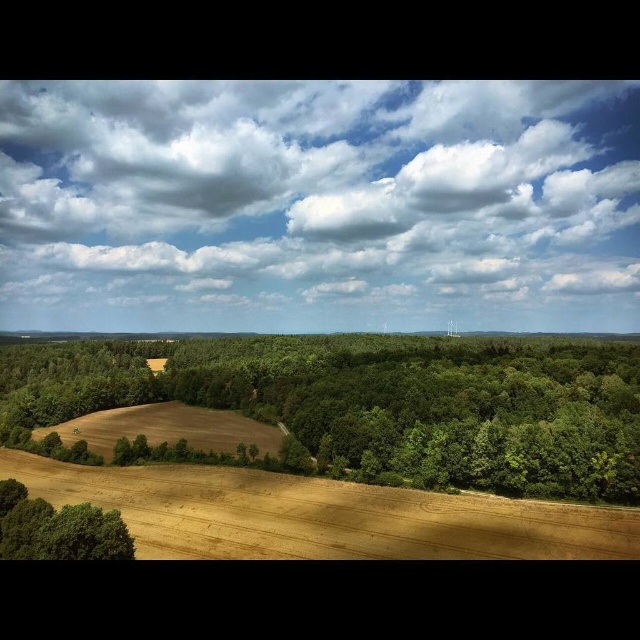
Question: Considering the relative positions of green leafy trees at center and golden dry wheat field at lower center in the image provided, where is green leafy trees at center located with respect to golden dry wheat field at lower center?

Choices:
 (A) left
 (B) right

Answer: (A)

Question: Is green leafy trees at center to the left of green leafy tree at lower left from the viewer's perspective?

Choices:
 (A) no
 (B) yes

Answer: (A)

Question: Does green leafy trees at center come in front of golden dry wheat field at lower center?

Choices:
 (A) yes
 (B) no

Answer: (B)

Question: Based on their relative distances, which object is farther from the green leafy tree at lower left?

Choices:
 (A) golden dry wheat field at lower center
 (B) green leafy trees at center
 (C) white fluffy cloud at upper center

Answer: (C)

Question: Which point is closer to the camera?

Choices:
 (A) (179, 506)
 (B) (397, 364)
 (C) (124, 552)
 (D) (99, 259)

Answer: (C)

Question: Which is farther from the green leafy tree at lower left?

Choices:
 (A) white fluffy cloud at upper center
 (B) green leafy trees at center
 (C) golden dry wheat field at lower center

Answer: (A)